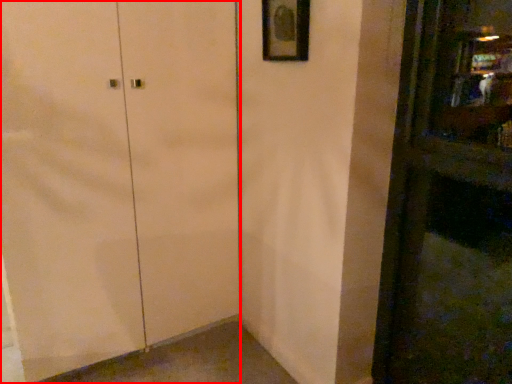
Question: In this image, where is door (annotated by the red box) located relative to picture frame?

Choices:
 (A) right
 (B) left

Answer: (B)